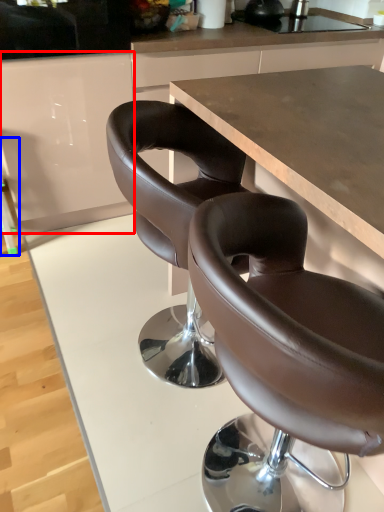
Question: Which point is closer to the camera, cabinetry (highlighted by a red box) or bar stool (highlighted by a blue box)?

Choices:
 (A) cabinetry
 (B) bar stool

Answer: (A)